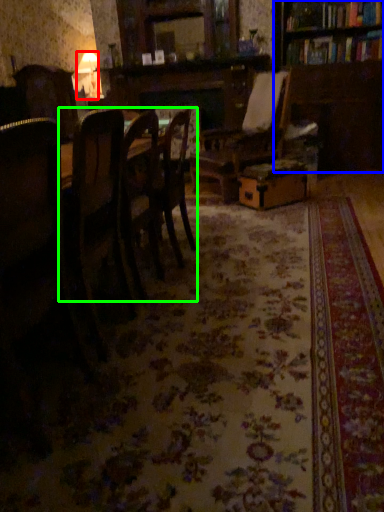
Question: Considering the real-world distances, which object is closest to lamp (highlighted by a red box)? bookcase (highlighted by a blue box) or kitchen & dining room table (highlighted by a green box).

Choices:
 (A) bookcase
 (B) kitchen & dining room table

Answer: (A)